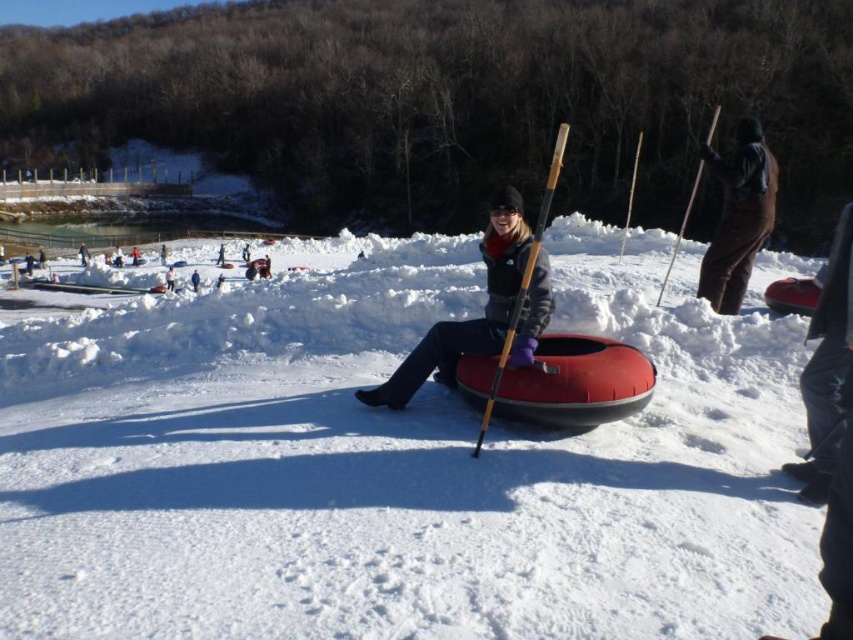
The height and width of the screenshot is (640, 853). In order to click on red rubber tube at center in this screenshot , I will do `click(561, 381)`.

Is red rubber tube at center to the right of matte black jacket at center from the viewer's perspective?

Yes, red rubber tube at center is to the right of matte black jacket at center.

At what (x,y) coordinates should I click in order to perform the action: click on red rubber tube at center. Please return your answer as a coordinate pair (x, y). Image resolution: width=853 pixels, height=640 pixels. Looking at the image, I should click on (561, 381).

At what (x,y) coordinates should I click in order to perform the action: click on red rubber tube at center. Please return your answer as a coordinate pair (x, y). Image resolution: width=853 pixels, height=640 pixels. Looking at the image, I should click on [x=561, y=381].

Between matte black jacket at center and dark gray jacket at center, which one appears on the right side from the viewer's perspective?

matte black jacket at center

Can you confirm if matte black jacket at center is smaller than dark gray jacket at center?

Yes.

Who is more distant from viewer, [519,348] or [86,260]?

Positioned behind is point [86,260].

This screenshot has width=853, height=640. In order to click on matte black jacket at center in this screenshot , I will do `click(471, 317)`.

Is red rubber tube at center taller than white snowboard at center?

In fact, red rubber tube at center may be shorter than white snowboard at center.

Does red rubber tube at center appear under white snowboard at center?

Yes, red rubber tube at center is below white snowboard at center.

You are a GUI agent. You are given a task and a screenshot of the screen. Output one action in this format:
    pyautogui.click(x=<x>, y=<y>)
    Task: Click on the red rubber tube at center
    
    Given the screenshot: What is the action you would take?
    pyautogui.click(x=561, y=381)